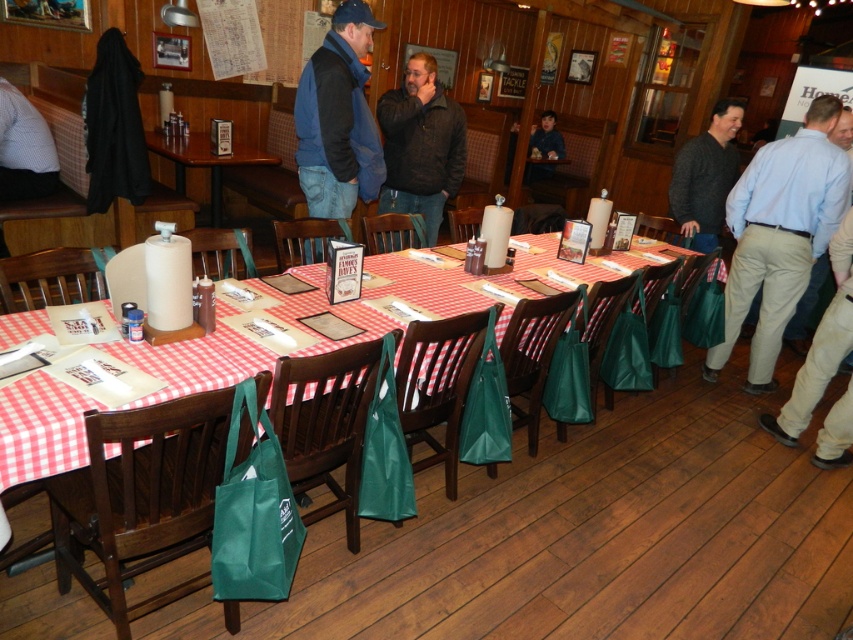
You are a waiter in the restaurant and need to place a new menu on the table. Where should you put it so that it is visible to the guests sitting at the wooden table at center? Consider the position of the red checkered tablecloth at center.

The red checkered tablecloth at center is below the wooden table at center, so the menu should be placed on the surface of the wooden table at center where guests can easily see it.

You are at the rustic restaurant and want to move from the point marked as point (221,301) to the point marked as point (165,147). Which direction should you move in?

You should move backward because point (221,301) is in front of point (165,147), so moving backward will take you towards the latter point.